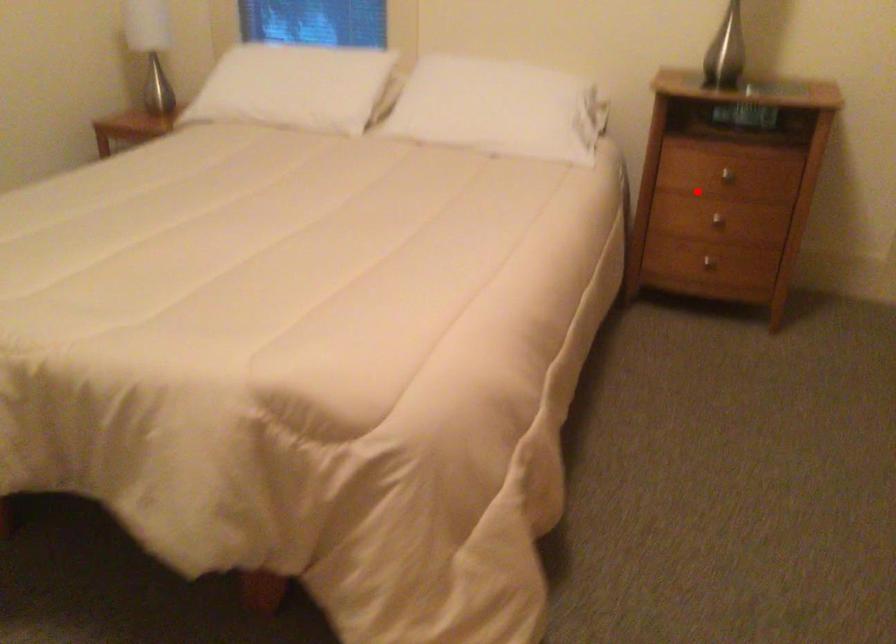
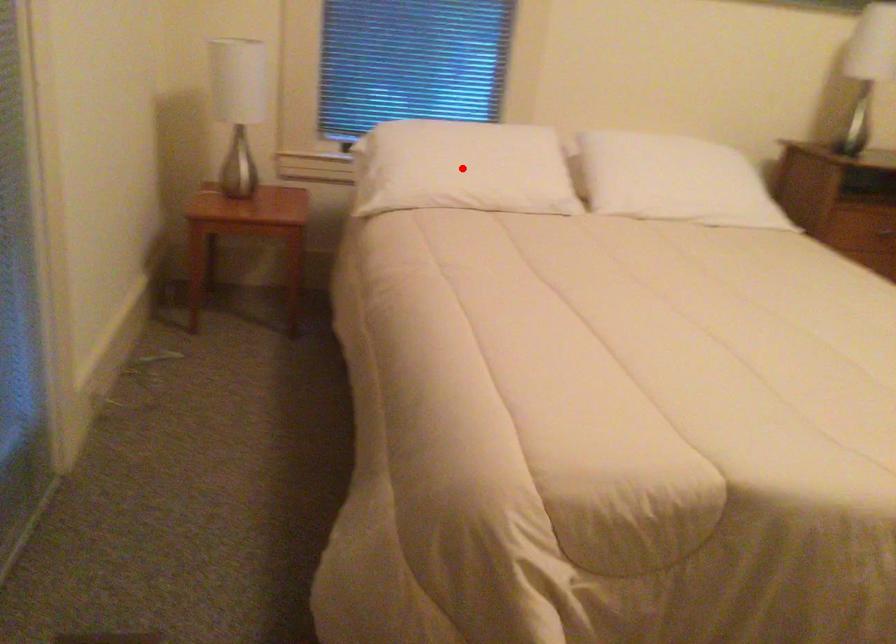
I am providing you with two images of the same scene from different viewpoints. A red point is marked on the first image and another point is marked on the second image. Do the highlighted points in image1 and image2 indicate the same real-world spot?

No